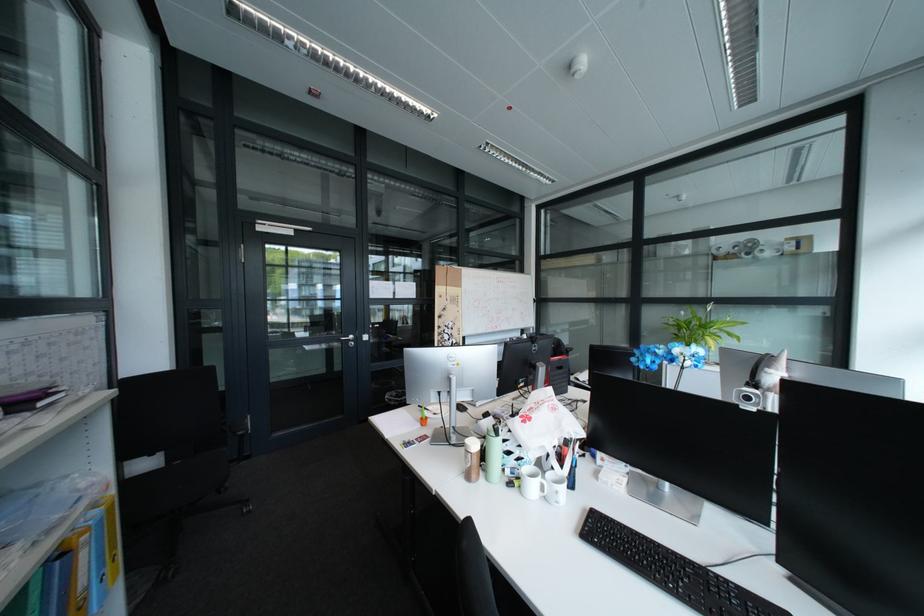
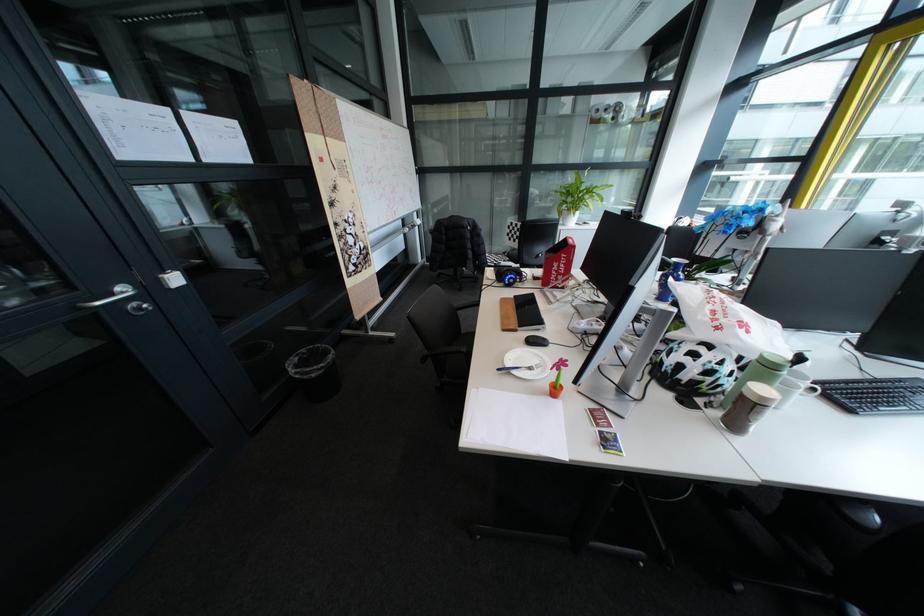
Locate, in the second image, the point that corresponds to point 365,344 in the first image.

(152, 309)